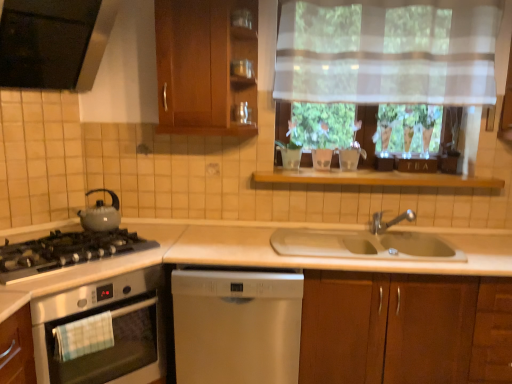
Question: Is matte gray kettle at left, which appears as the 2th kitchen appliance when ordered from the bottom, wider or thinner than stainless steel oven at left, which is counted as the second kitchen appliance, starting from the top?

Choices:
 (A) wide
 (B) thin

Answer: (B)

Question: Considering their positions, is matte gray kettle at left, positioned as the 1th kitchen appliance in top-to-bottom order, located in front of or behind stainless steel oven at left, which is counted as the second kitchen appliance, starting from the top?

Choices:
 (A) behind
 (B) front

Answer: (A)

Question: Considering the real-world distances, which object is farthest from the stainless steel oven at left, the first kitchen appliance in the bottom-to-top sequence?

Choices:
 (A) translucent fabric at upper center
 (B) matte glass jar at upper center
 (C) wooden cabinet at lower right, arranged as the 2th cabinetry when viewed from the left
 (D) matte gray kettle at left, which appears as the 2th kitchen appliance when ordered from the bottom
 (E) wooden shelf at center

Answer: (B)

Question: Based on their relative distances, which object is farther from the matte gray gas stove at left?

Choices:
 (A) wooden cabinet at lower right, the second cabinetry when ordered from top to bottom
 (B) stainless steel oven at left, which is counted as the second kitchen appliance, starting from the top
 (C) wooden cabinet at upper center, placed as the 1th cabinetry when sorted from top to bottom
 (D) wooden shelf at center
 (E) matte glass jar at upper center

Answer: (A)